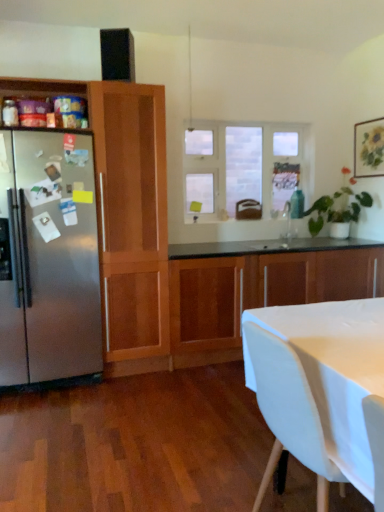
Question: From the image's perspective, is clear glass window at center above or below wooden cabinet at center, the 1th cabinetry from the right?

Choices:
 (A) below
 (B) above

Answer: (B)

Question: Is point (206, 158) closer or farther from the camera than point (192, 301)?

Choices:
 (A) farther
 (B) closer

Answer: (A)

Question: Estimate the real-world distances between objects in this image. Which object is farther from the clear glass window at center?

Choices:
 (A) white fabric chair at lower right
 (B) wooden cabinet at left, which is counted as the first cabinetry, starting from the left
 (C) satin stainless steel refrigerator at left
 (D) wooden cabinet at center, the second cabinetry positioned from the left

Answer: (A)

Question: Which of these objects is positioned closest to the wooden cabinet at left, marked as the second cabinetry in a right-to-left arrangement?

Choices:
 (A) wooden cabinet at center, the 1th cabinetry from the right
 (B) white fabric chair at lower right
 (C) clear glass window at center
 (D) satin stainless steel refrigerator at left

Answer: (D)